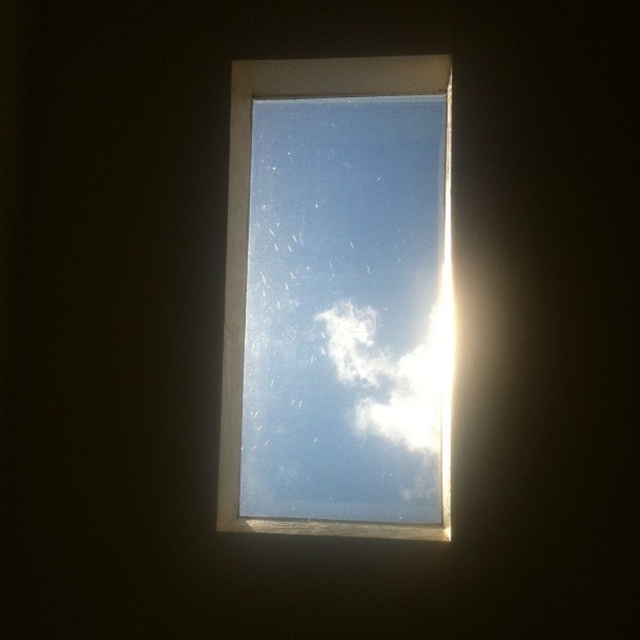
Who is higher up, transparent glass window at upper center or white fluffy cloud at upper center?

transparent glass window at upper center

This screenshot has height=640, width=640. Describe the element at coordinates (248, 250) in the screenshot. I see `transparent glass window at upper center` at that location.

Image resolution: width=640 pixels, height=640 pixels. What are the coordinates of `transparent glass window at upper center` in the screenshot? It's located at (248, 250).